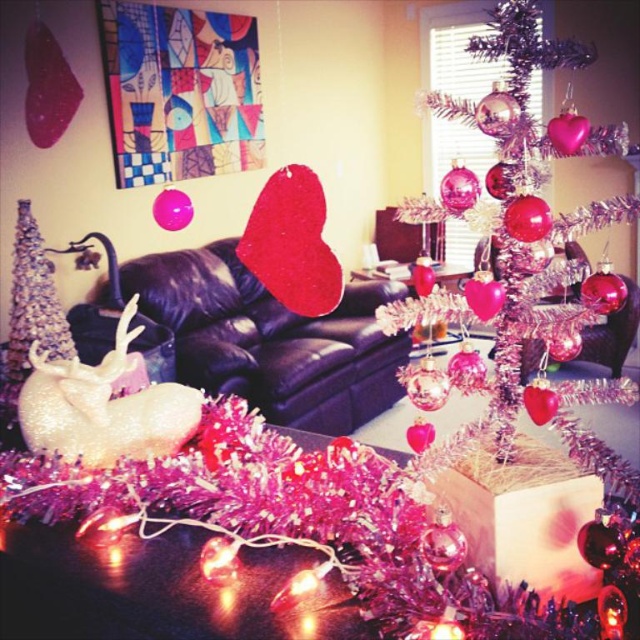
Looking at this image, which is more to the left, shiny silver christmas tree at center or shiny silver christmas tree at left?

Positioned to the left is shiny silver christmas tree at left.

Does point (536, 291) come behind point (17, 342)?

No, (536, 291) is closer to viewer.

Image resolution: width=640 pixels, height=640 pixels. What do you see at coordinates (528, 224) in the screenshot? I see `shiny silver christmas tree at center` at bounding box center [528, 224].

This screenshot has height=640, width=640. In order to click on shiny silver christmas tree at center in this screenshot , I will do `click(528, 224)`.